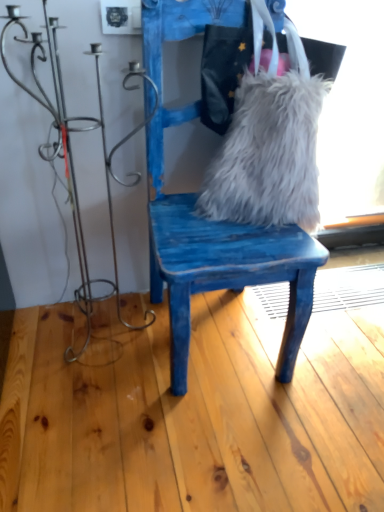
Locate an element on the screen. Image resolution: width=384 pixels, height=512 pixels. blue distressed wood chair at center is located at coordinates (220, 257).

In order to face blue distressed wood chair at center, should I rotate leftwards or rightwards?

A 4.110 degree turn to the right will do.

This screenshot has height=512, width=384. What do you see at coordinates (220, 257) in the screenshot?
I see `blue distressed wood chair at center` at bounding box center [220, 257].

The width and height of the screenshot is (384, 512). Find the location of `blue distressed wood chair at center`. blue distressed wood chair at center is located at coordinates (220, 257).